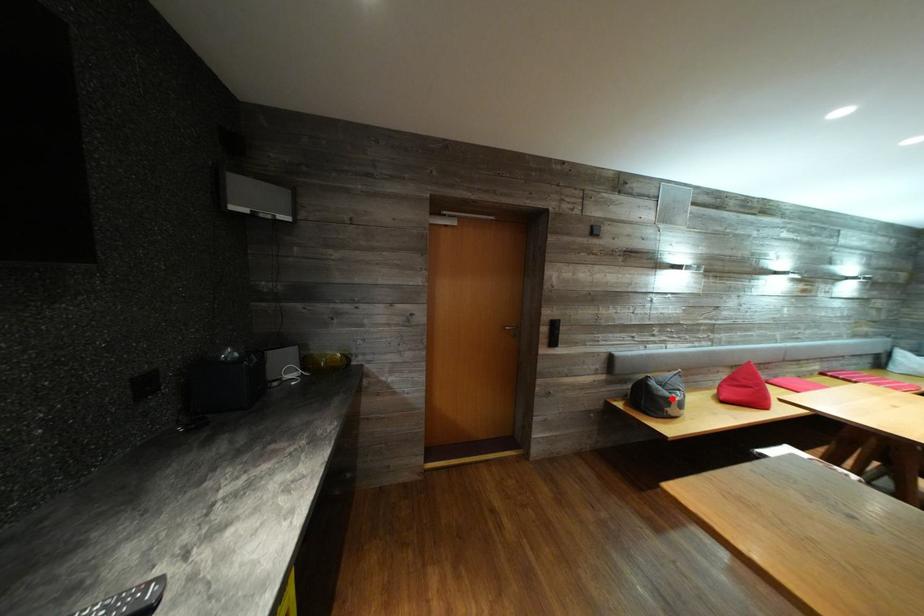
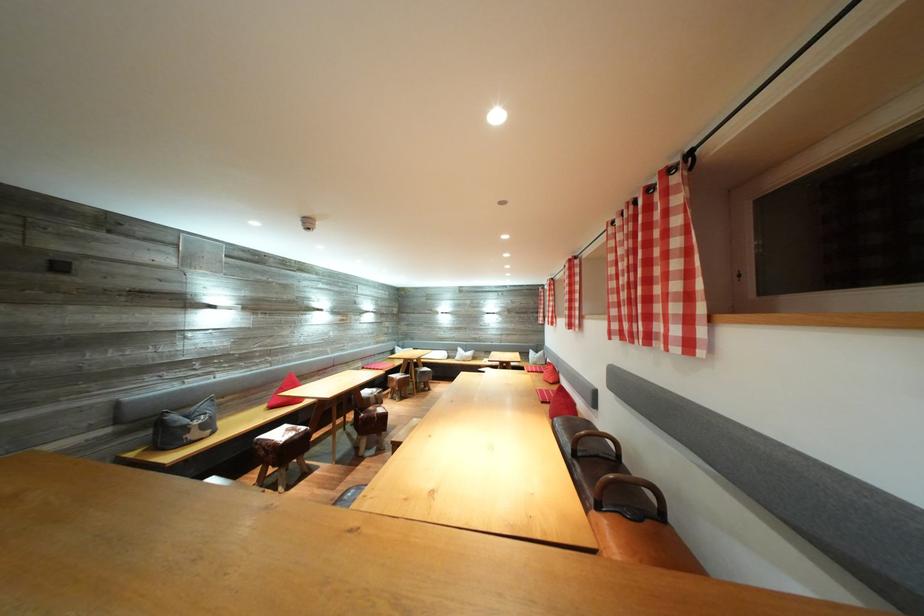
The point at the highlighted location is marked in the first image. Where is the corresponding point in the second image?

(192, 427)